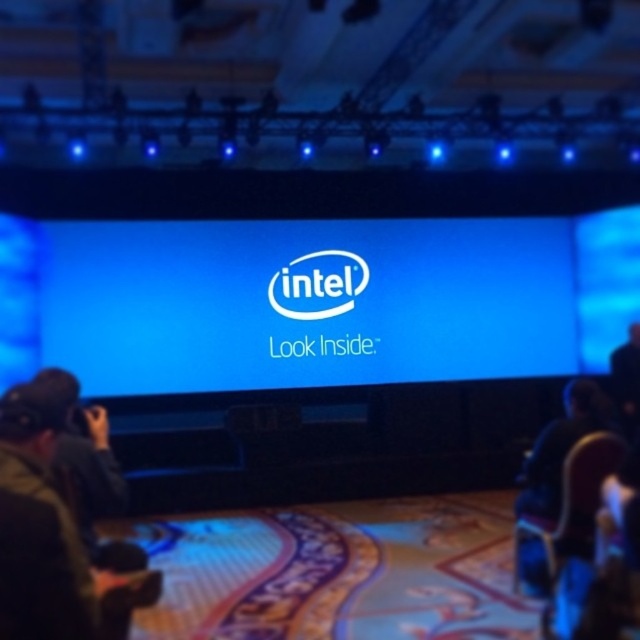
Question: Which point appears closest to the camera in this image?

Choices:
 (A) [x=10, y=481]
 (B) [x=422, y=333]

Answer: (A)

Question: Does dark green jacket at lower left have a larger size compared to black fabric man at right?

Choices:
 (A) no
 (B) yes

Answer: (B)

Question: Is blue glossy screen at center positioned behind dark green jacket at lower left?

Choices:
 (A) no
 (B) yes

Answer: (B)

Question: Does blue glossy screen at center come behind white smooth logo at center?

Choices:
 (A) no
 (B) yes

Answer: (A)

Question: Which point is farther to the camera?

Choices:
 (A) blue glossy screen at center
 (B) white smooth logo at center

Answer: (B)

Question: Which point is closer to the camera taking this photo?

Choices:
 (A) (339, 280)
 (B) (58, 403)
 (C) (621, 378)

Answer: (B)